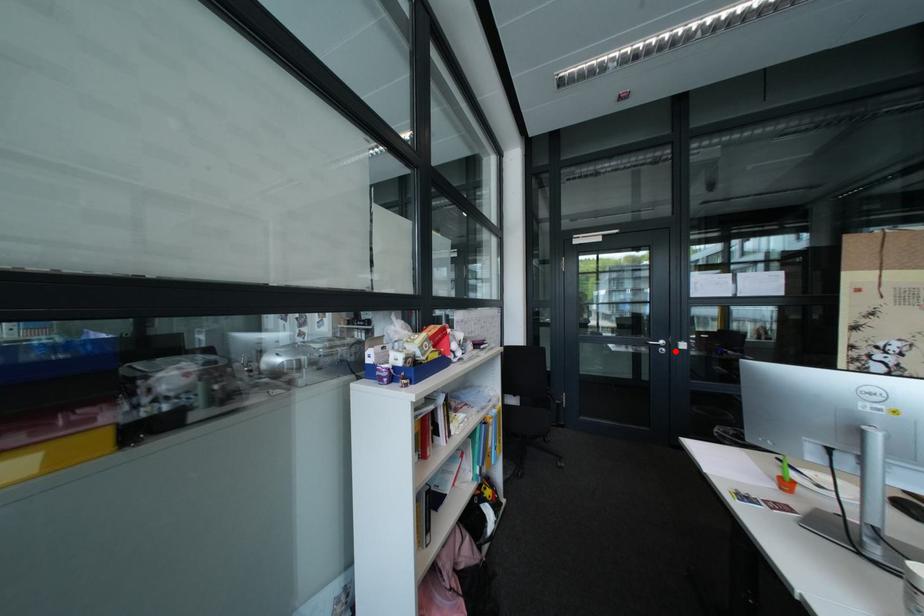
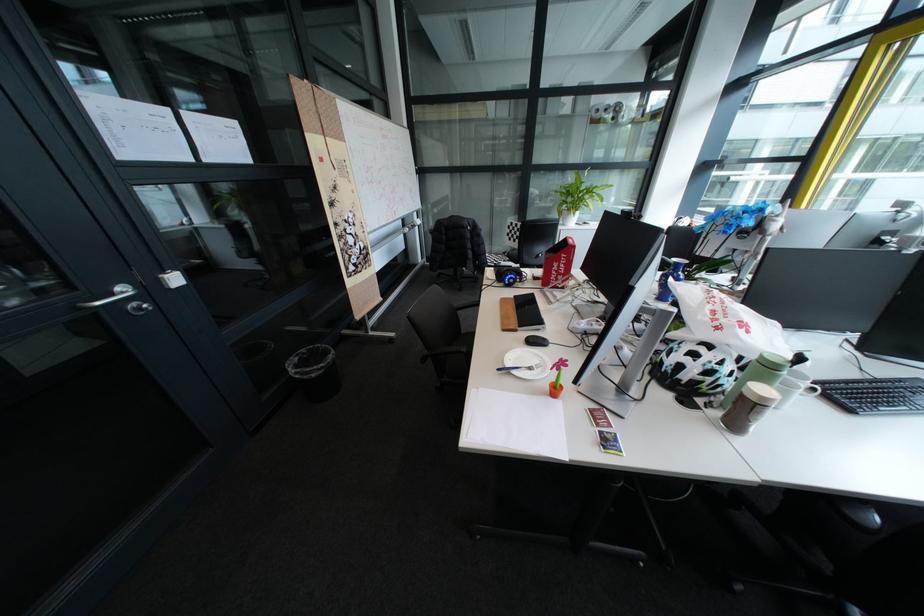
Question: I am providing you with two images of the same scene from different viewpoints. Given a red point in image1, look at the same physical point in image2. Is it:

Choices:
 (A) Closer to the viewpoint
 (B) Farther from the viewpoint

Answer: (B)